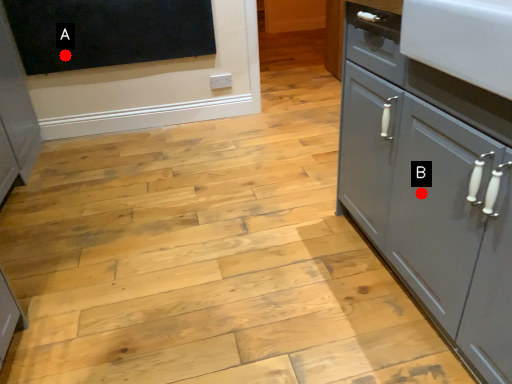
Question: Two points are circled on the image, labeled by A and B beside each circle. Among these points, which one is nearest to the camera?

Choices:
 (A) A is closer
 (B) B is closer

Answer: (B)